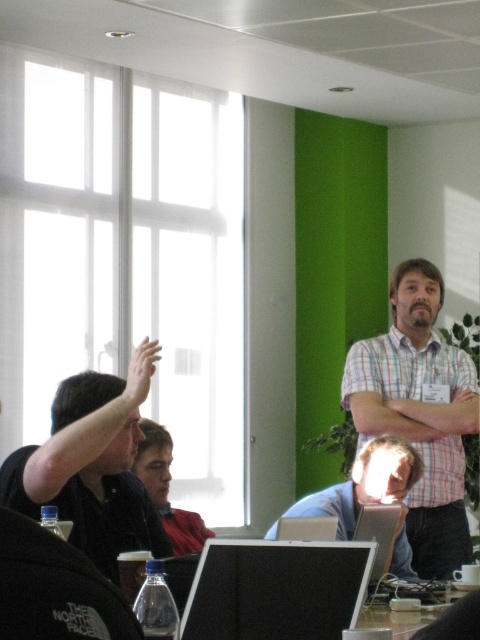
Does point (132, 410) come closer to viewer compared to point (276, 566)?

That is False.

Describe the element at coordinates (93, 465) in the screenshot. I see `black matte shirt at left` at that location.

You are a GUI agent. You are given a task and a screenshot of the screen. Output one action in this format:
    pyautogui.click(x=<x>, y=<y>)
    Task: Click on the black matte shirt at left
    Image resolution: width=480 pixels, height=640 pixels.
    Given the screenshot: What is the action you would take?
    pyautogui.click(x=93, y=465)

Consider the image. Does black plastic table at lower center have a larger size compared to matte black hand at upper right?

Indeed, black plastic table at lower center has a larger size compared to matte black hand at upper right.

Measure the distance from black plastic table at lower center to matte black hand at upper right.

black plastic table at lower center and matte black hand at upper right are 3.40 meters apart.

Which is in front, point (476, 620) or point (466, 397)?

Point (476, 620) is in front.

The height and width of the screenshot is (640, 480). Find the location of `black plastic table at lower center`. black plastic table at lower center is located at coordinates [x=455, y=620].

At what (x,y) coordinates should I click in order to perform the action: click on plaid shirt at upper right. Please return your answer as a coordinate pair (x, y). The width and height of the screenshot is (480, 640). Looking at the image, I should click on (419, 412).

Who is taller, plaid shirt at upper right or matte skin hand at upper left?

plaid shirt at upper right

Which is behind, point (420, 262) or point (144, 387)?

Positioned behind is point (420, 262).

This screenshot has height=640, width=480. Identify the location of plaid shirt at upper right. (419, 412).